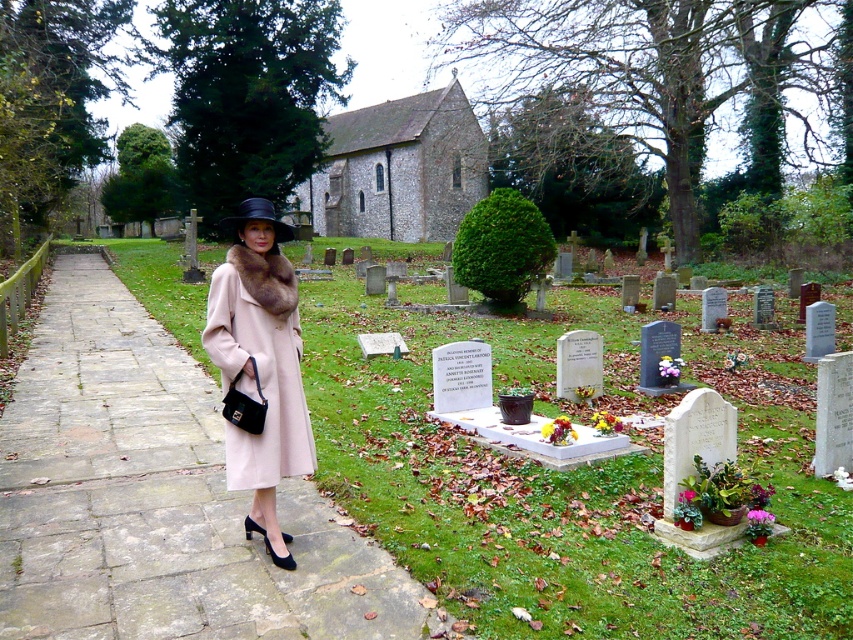
Which of these two, matte pink coat at center or black felt hat at center, stands shorter?

matte pink coat at center

Is matte pink coat at center smaller than black felt hat at center?

Yes, matte pink coat at center is smaller than black felt hat at center.

You are a GUI agent. You are given a task and a screenshot of the screen. Output one action in this format:
    pyautogui.click(x=<x>, y=<y>)
    Task: Click on the matte pink coat at center
    Image resolution: width=853 pixels, height=640 pixels.
    Given the screenshot: What is the action you would take?
    pyautogui.click(x=260, y=364)

Find the location of `matte pink coat at center`. matte pink coat at center is located at coordinates (260, 364).